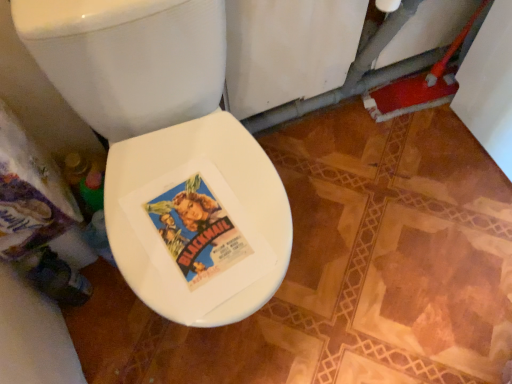
Question: Do you think white glossy toilet seat at center is within white glossy bidet at center, or outside of it?

Choices:
 (A) inside
 (B) outside

Answer: (B)

Question: Is white glossy toilet seat at center taller or shorter than white glossy bidet at center?

Choices:
 (A) tall
 (B) short

Answer: (A)

Question: From the image's perspective, is white glossy toilet seat at center located above or below white glossy bidet at center?

Choices:
 (A) below
 (B) above

Answer: (B)

Question: Is white glossy bidet at center in front of or behind white glossy toilet seat at center in the image?

Choices:
 (A) behind
 (B) front

Answer: (A)

Question: Is white glossy bidet at center inside or outside of white glossy toilet seat at center?

Choices:
 (A) inside
 (B) outside

Answer: (A)

Question: Looking at their shapes, would you say white glossy bidet at center is wider or thinner than white glossy toilet seat at center?

Choices:
 (A) thin
 (B) wide

Answer: (A)

Question: Considering the positions of white glossy bidet at center and white glossy toilet seat at center in the image, is white glossy bidet at center taller or shorter than white glossy toilet seat at center?

Choices:
 (A) tall
 (B) short

Answer: (B)